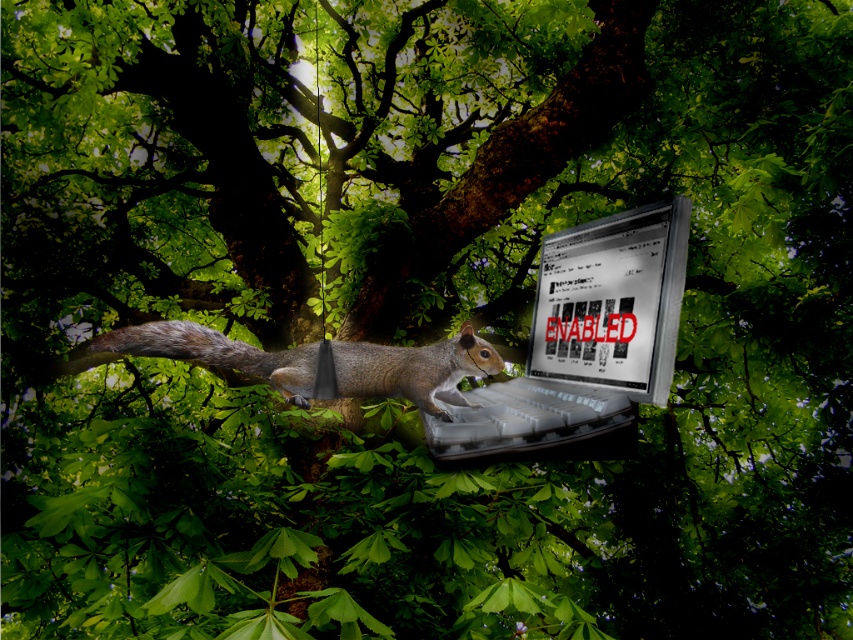
Question: Is metallic silver laptop at center to the right of shiny silver laptop at center from the viewer's perspective?

Choices:
 (A) yes
 (B) no

Answer: (B)

Question: Which point is closer to the camera taking this photo?

Choices:
 (A) (169, 337)
 (B) (589, 300)
 (C) (677, 298)
 (D) (439, 352)

Answer: (C)

Question: Among these objects, which one is farthest from the camera?

Choices:
 (A) metallic silver laptop at center
 (B) fuzzy brown tail at center
 (C) shiny silver laptop at center

Answer: (B)

Question: Can you confirm if shiny silver laptop at center is positioned to the left of fuzzy brown tail at center?

Choices:
 (A) yes
 (B) no

Answer: (B)

Question: Which point is farther to the camera?

Choices:
 (A) shiny silver laptop at center
 (B) gray fur squirrel at center

Answer: (B)

Question: Does shiny silver laptop at center lie behind gray fur squirrel at center?

Choices:
 (A) no
 (B) yes

Answer: (A)